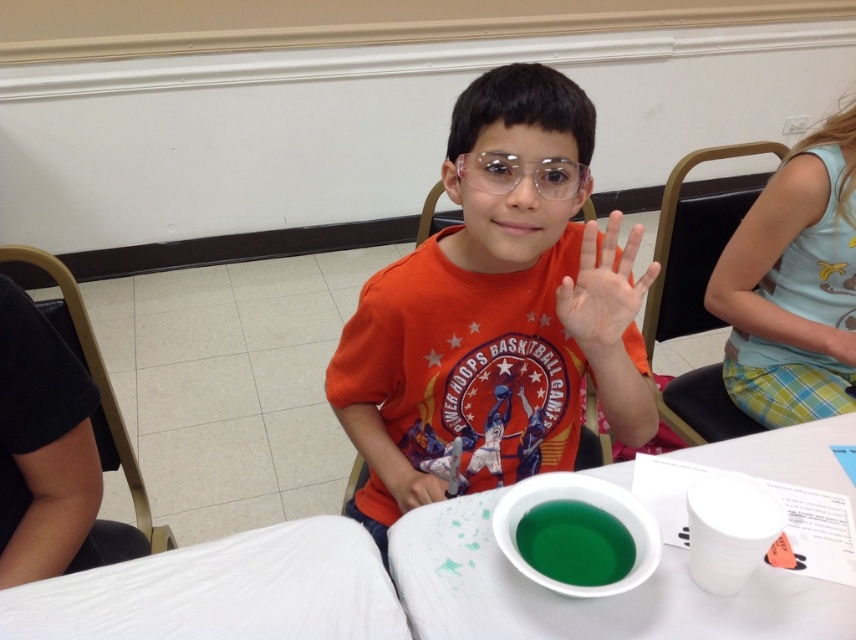
Looking at this image, between orange cotton shirt at center and matte orange shirt at center, which one appears on the right side from the viewer's perspective?

Positioned to the right is orange cotton shirt at center.

Does orange cotton shirt at center appear on the left side of matte orange shirt at center?

No, orange cotton shirt at center is not to the left of matte orange shirt at center.

The height and width of the screenshot is (640, 856). Find the location of `orange cotton shirt at center`. orange cotton shirt at center is located at coordinates (497, 308).

Find the location of a particular element. This screenshot has height=640, width=856. orange cotton shirt at center is located at coordinates click(x=497, y=308).

Does orange cotton shirt at center appear over pale skin hand at center?

Incorrect, orange cotton shirt at center is not positioned above pale skin hand at center.

Between point (330, 394) and point (602, 292), which one is positioned in front?

Point (602, 292)

What are the coordinates of `orange cotton shirt at center` in the screenshot? It's located at (497, 308).

Is orange cotton shirt at center positioned behind green liquid at table center?

No.

Is orange cotton shirt at center above green liquid at table center?

Yes.

Between point (477, 132) and point (628, 563), which one is positioned behind?

The point (477, 132) is more distant.

This screenshot has height=640, width=856. Identify the location of orange cotton shirt at center. (497, 308).